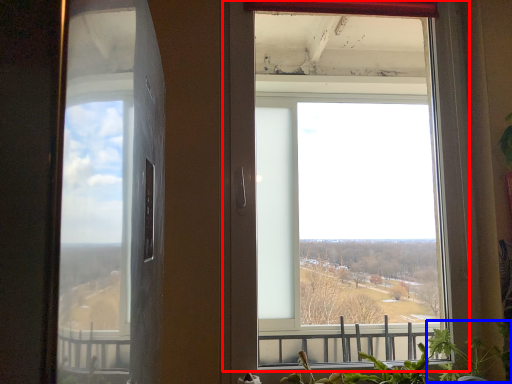
Question: Among these objects, which one is nearest to the camera, window (highlighted by a red box) or plant (highlighted by a blue box)?

Choices:
 (A) window
 (B) plant

Answer: (B)